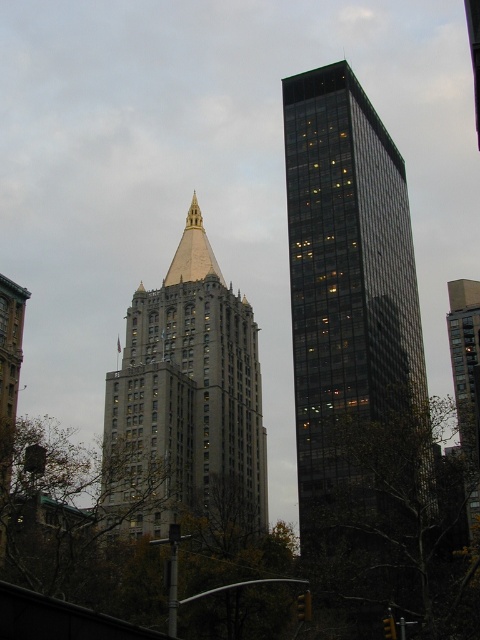
You are a drone operator who needs to fly a drone between the two skyscrapers. The drone has a maximum flight distance of 250 feet. Can the drone safely travel between the gray stone building at center and the other skyscraper?

The distance between the gray stone building at center and the other skyscraper is 253.17 feet, which exceeds the drone maximum flight distance of 250 feet. The drone cannot safely travel between them.

You are standing at the origin point of the coordinate system in the image. Which direction should you move to reach the gray stone building at center?

The gray stone building at center is located at point [186,403], so you should move northeast to reach it since both the x and y coordinates are higher than the origin.